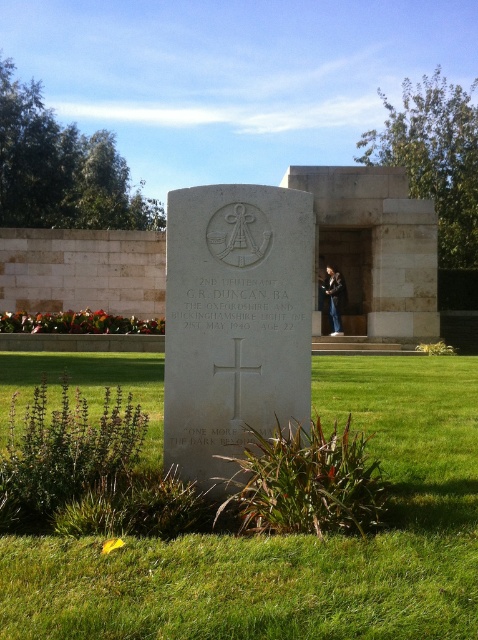
What is the exact coordinate of the green grass at center?

The green grass at center is located at point (293, 540).

You are a photographer standing at the base of the memorial. You want to take a clear photo of the white stone cross at center without the black leather jacket at center appearing in the frame. Is this possible given their positions?

The white stone cross at center is in front of the black leather jacket at center, so taking a clear photo of the white stone cross at center without the jacket would require adjusting the angle or moving the jacket to avoid obstruction.

You are a photographer setting up a tripod to take a photo of both the white stone cross at center and the black leather jacket at center. Since you want to ensure both objects are in focus, you need to know which one is taller. Which object is shorter?

The white stone cross at center is shorter than the black leather jacket at center, so the white stone cross at center is the shorter object.